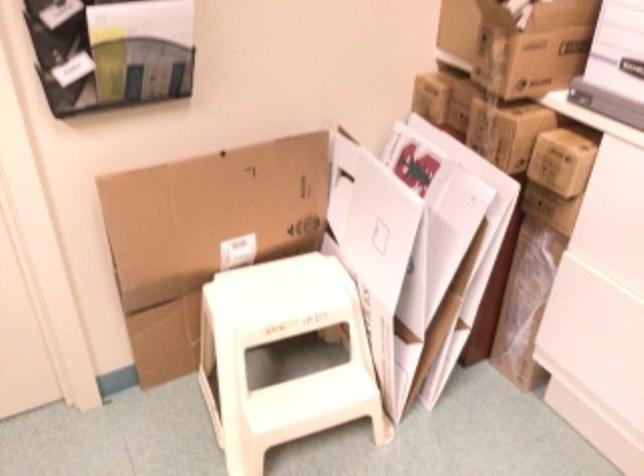
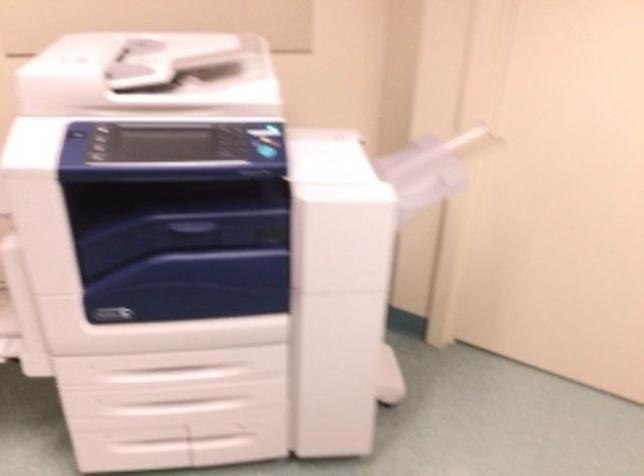
Question: The camera is either moving clockwise (left) or counter-clockwise (right) around the object. The first image is from the beginning of the video and the second image is from the end. Is the camera moving left or right when shooting the video?

Choices:
 (A) Left
 (B) Right

Answer: (B)